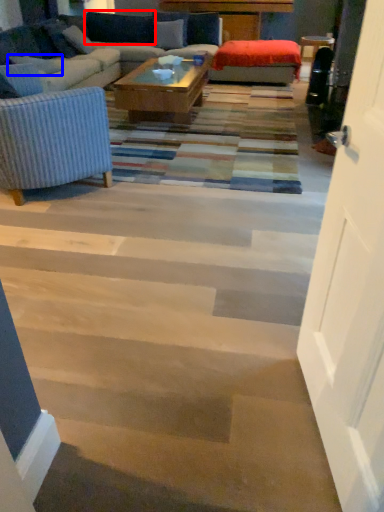
Question: Which object appears closest to the camera in this image, pillow (highlighted by a red box) or pillow (highlighted by a blue box)?

Choices:
 (A) pillow
 (B) pillow

Answer: (B)